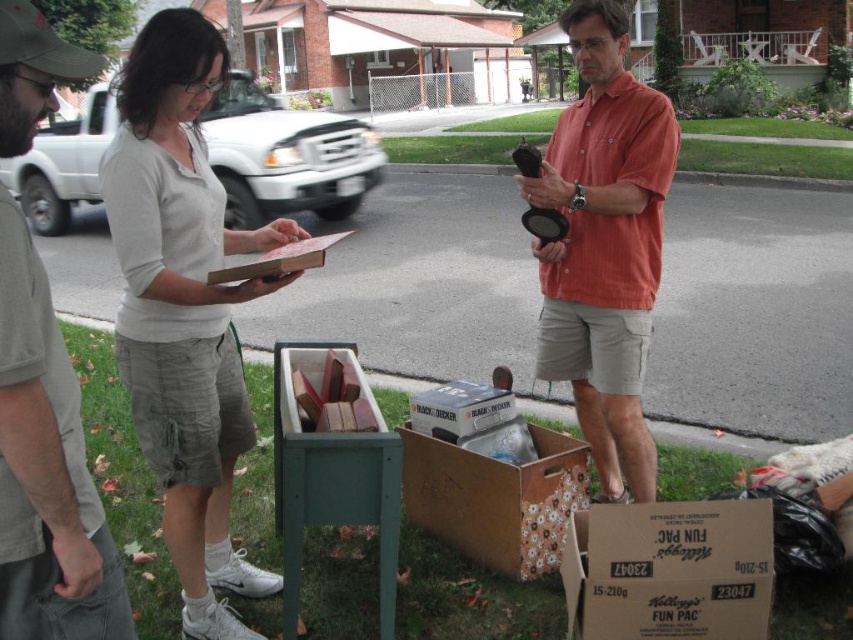
You are a delivery person who needs to place a large package on the sidewalk. You see the cardboard box at lower right and the black cardboard box at center. Which box should you choose to place your package on?

The cardboard box at lower right has a larger size compared to the black cardboard box at center, so you should choose the cardboard box at lower right to place your large package.

You are standing at the center of the image and want to place a new object at the same 2D location as the cardboard box at lower right. What are the coordinates you should use?

The coordinates for the cardboard box at lower right are at point (669,570), so you should place the new object at those coordinates.